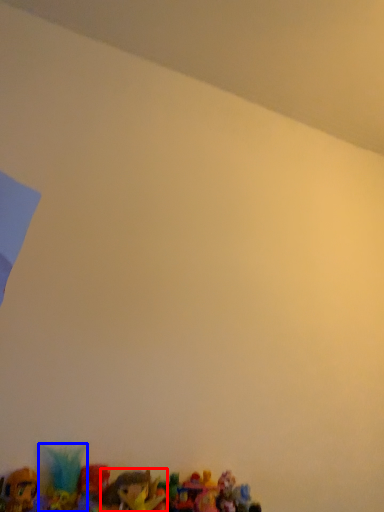
Question: Which object appears closest to the camera in this image, toy (highlighted by a red box) or toy (highlighted by a blue box)?

Choices:
 (A) toy
 (B) toy

Answer: (A)